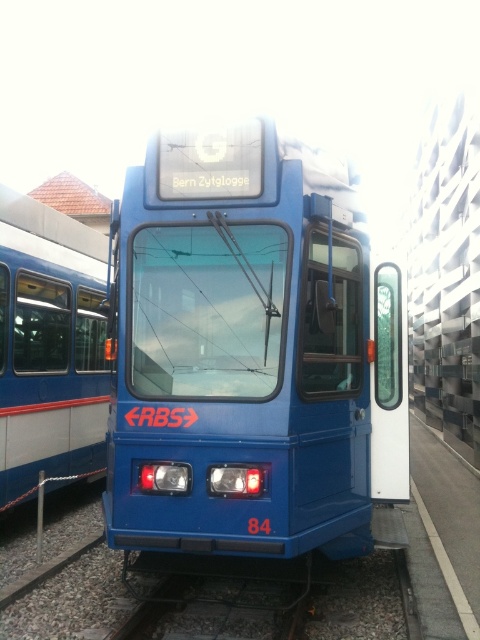
Can you confirm if blue matte train at center is shorter than blue painted metal passenger train at left?

Yes.

This screenshot has height=640, width=480. What do you see at coordinates (248, 353) in the screenshot? I see `blue matte train at center` at bounding box center [248, 353].

This screenshot has height=640, width=480. What are the coordinates of `blue matte train at center` in the screenshot? It's located at (248, 353).